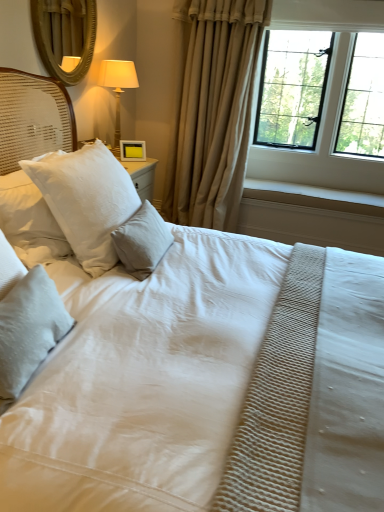
Question: Does white textured pillow at center, placed as the 3th pillow when sorted from front to back, have a greater height compared to white textured pillow at upper left, arranged as the 2th pillow when viewed from the back?

Choices:
 (A) yes
 (B) no

Answer: (B)

Question: Can you confirm if white textured pillow at center, the 1th pillow from the back, is positioned to the left of white textured pillow at upper left, placed as the second pillow when sorted from front to back?

Choices:
 (A) yes
 (B) no

Answer: (B)

Question: Does white textured pillow at center, the 1th pillow from the back, have a lesser height compared to white textured pillow at upper left, placed as the second pillow when sorted from front to back?

Choices:
 (A) no
 (B) yes

Answer: (B)

Question: Does white textured pillow at center, placed as the 3th pillow when sorted from front to back, have a lesser width compared to white textured pillow at upper left, arranged as the 2th pillow when viewed from the back?

Choices:
 (A) yes
 (B) no

Answer: (A)

Question: Does white textured pillow at center, placed as the 3th pillow when sorted from front to back, have a smaller size compared to white textured pillow at upper left, arranged as the 2th pillow when viewed from the back?

Choices:
 (A) yes
 (B) no

Answer: (A)

Question: Relative to white textured pillow at upper left, arranged as the 2th pillow when viewed from the back, is yellow matte picture frame at upper center in front or behind?

Choices:
 (A) behind
 (B) front

Answer: (A)

Question: Choose the correct answer: Is yellow matte picture frame at upper center inside white textured pillow at upper left, arranged as the 2th pillow when viewed from the back, or outside it?

Choices:
 (A) outside
 (B) inside

Answer: (A)

Question: Is yellow matte picture frame at upper center to the left or to the right of white textured pillow at upper left, placed as the second pillow when sorted from front to back, in the image?

Choices:
 (A) right
 (B) left

Answer: (B)

Question: Is point (122, 158) closer or farther from the camera than point (92, 221)?

Choices:
 (A) closer
 (B) farther

Answer: (B)

Question: From a real-world perspective, relative to white textured pillow at upper left, arranged as the 2th pillow when viewed from the back, is beige fabric curtain at center vertically above or below?

Choices:
 (A) above
 (B) below

Answer: (A)

Question: Is beige fabric curtain at center taller or shorter than white textured pillow at upper left, placed as the second pillow when sorted from front to back?

Choices:
 (A) tall
 (B) short

Answer: (A)

Question: Would you say beige fabric curtain at center is to the left or to the right of white textured pillow at upper left, placed as the second pillow when sorted from front to back, in the picture?

Choices:
 (A) left
 (B) right

Answer: (B)

Question: Looking at their shapes, would you say beige fabric curtain at center is wider or thinner than white textured pillow at upper left, arranged as the 2th pillow when viewed from the back?

Choices:
 (A) thin
 (B) wide

Answer: (B)

Question: Considering the positions of white textured pillow at center, the 1th pillow from the back, and black metal window at upper right in the image, is white textured pillow at center, the 1th pillow from the back, wider or thinner than black metal window at upper right?

Choices:
 (A) thin
 (B) wide

Answer: (A)

Question: Would you say white textured pillow at center, placed as the 3th pillow when sorted from front to back, is to the left or to the right of black metal window at upper right in the picture?

Choices:
 (A) left
 (B) right

Answer: (A)